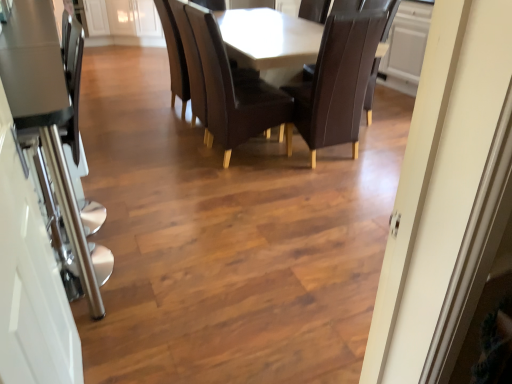
Question: Considering the relative positions of clear glass door at left and dark brown leather chair at center, which ranks as the second chair in left-to-right order, in the image provided, is clear glass door at left to the left or to the right of dark brown leather chair at center, which ranks as the second chair in left-to-right order,?

Choices:
 (A) right
 (B) left

Answer: (B)

Question: Looking at the image, does clear glass door at left seem bigger or smaller compared to dark brown leather chair at center, which appears as the first chair when viewed from the right?

Choices:
 (A) small
 (B) big

Answer: (A)

Question: Which object is the farthest from the leather at center, which is counted as the second chair, starting from the right?

Choices:
 (A) clear glass door at left
 (B) dark brown leather chair at center, which appears as the first chair when viewed from the right
 (C) matte brown table at center

Answer: (A)

Question: Which object is the closest to the clear glass door at left?

Choices:
 (A) matte brown table at center
 (B) leather at center, the first chair positioned from the left
 (C) dark brown leather chair at center, which ranks as the second chair in left-to-right order

Answer: (B)